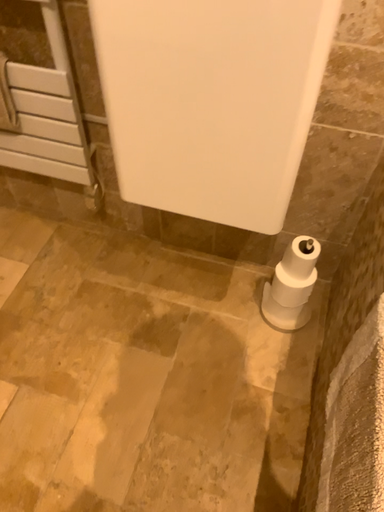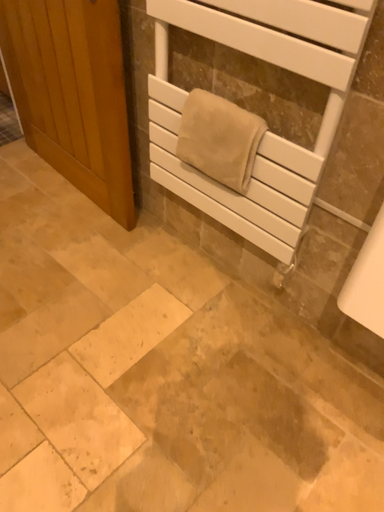
Question: Which way did the camera rotate in the video?

Choices:
 (A) rotated upward
 (B) rotated downward

Answer: (A)